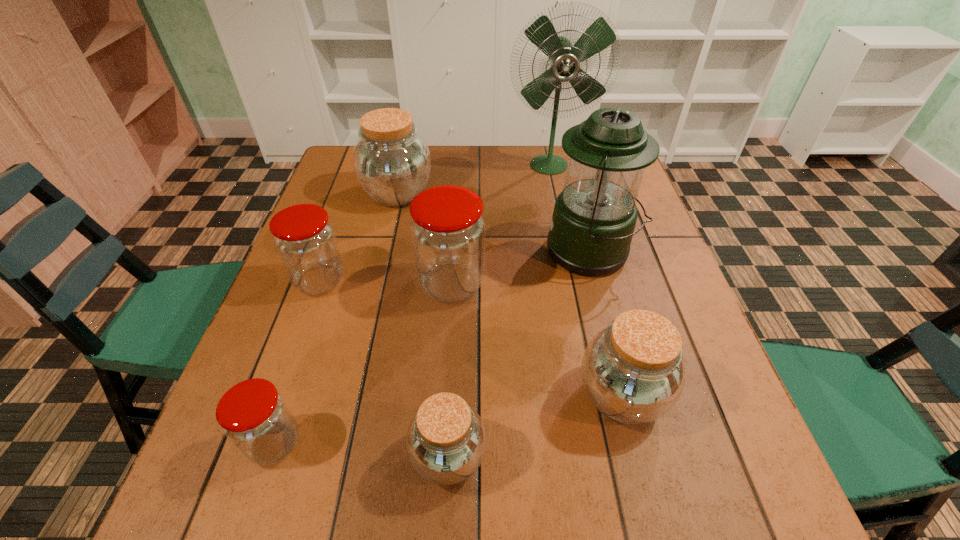
The width and height of the screenshot is (960, 540). Find the location of `vacant area between the leftmost brown jar and the lantern`. vacant area between the leftmost brown jar and the lantern is located at coordinates (494, 222).

Image resolution: width=960 pixels, height=540 pixels. In order to click on vacant space that's between the second biggest red jar and the smallest red jar in this screenshot , I will do pyautogui.click(x=298, y=362).

Image resolution: width=960 pixels, height=540 pixels. I want to click on object that can be found as the third closest to the nearest red jar, so click(x=448, y=231).

The image size is (960, 540). I want to click on object that is the second closest to the second smallest red jar, so pyautogui.click(x=392, y=162).

Where is `jar that is the second closest one to the lantern`? The height and width of the screenshot is (540, 960). jar that is the second closest one to the lantern is located at coordinates (632, 371).

Identify which jar is located as the nearest to the second smallest brown jar. Please provide its 2D coordinates. Your answer should be formatted as a tuple, i.e. [(x, y)], where the tuple contains the x and y coordinates of a point satisfying the conditions above.

[(446, 440)]

Where is `brown jar that stands as the closest to the rightmost red jar`? The image size is (960, 540). brown jar that stands as the closest to the rightmost red jar is located at coordinates (392, 162).

At what (x,y) coordinates should I click in order to perform the action: click on the second closest brown jar relative to the smallest brown jar. Please return your answer as a coordinate pair (x, y). Looking at the image, I should click on (392, 162).

At what (x,y) coordinates should I click in order to perform the action: click on red jar object that ranks as the closest to the second biggest red jar. Please return your answer as a coordinate pair (x, y). The height and width of the screenshot is (540, 960). Looking at the image, I should click on (448, 231).

Locate an element on the screen. The image size is (960, 540). red jar that stands as the closest to the second smallest red jar is located at coordinates (448, 231).